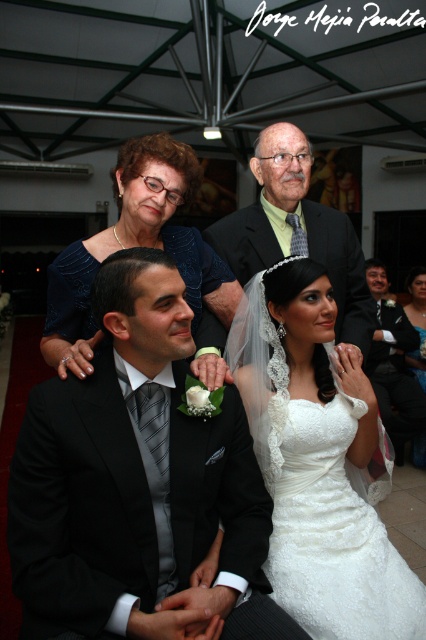
You are a photographer at a wedding. You need to capture a photo of the white lace dress at center and the matte black suit at upper center. Based on their positions, which one is lower in the image?

The white lace dress at center is below the matte black suit at upper center, so the white lace dress at center is lower in the image.

You are a photographer standing at the back of the wedding venue. You want to take a photo of the black satin suit at center and white satin dress at center so that both are in focus. The camera you are using has a depth of field that can cover 3 meters. Will both subjects be in focus?

The black satin suit at center and white satin dress at center are 3.11 meters apart from each other. Since the camera can only cover 3 meters, the distance between them exceeds the depth of field, so both subjects cannot be in focus simultaneously.